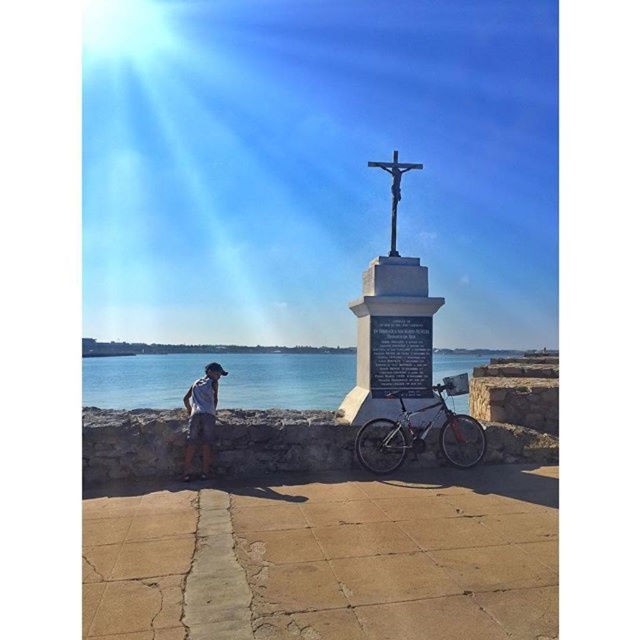
How much distance is there between polished stone cross at center and wooden cross at center?

polished stone cross at center and wooden cross at center are 1.05 meters apart from each other.

Which is behind, point (417, 307) or point (392, 234)?

Point (392, 234)

The image size is (640, 640). I want to click on polished stone cross at center, so click(x=392, y=323).

Between silver metallic bicycle at center and wooden cross at center, which one is positioned higher?

wooden cross at center is higher up.

Is silver metallic bicycle at center wider than wooden cross at center?

Correct, the width of silver metallic bicycle at center exceeds that of wooden cross at center.

Between point (404, 435) and point (392, 163), which one is positioned behind?

Positioned behind is point (392, 163).

Where is `silver metallic bicycle at center`? This screenshot has height=640, width=640. silver metallic bicycle at center is located at coordinates (420, 433).

Can you confirm if silver metallic bicycle at center is smaller than light brown shorts at lower left?

No.

Is silver metallic bicycle at center closer to camera compared to light brown shorts at lower left?

No, silver metallic bicycle at center is further to the viewer.

Who is more distant from viewer, (394, 429) or (211, 440)?

Point (394, 429)

Find the location of `silver metallic bicycle at center`. silver metallic bicycle at center is located at coordinates (420, 433).